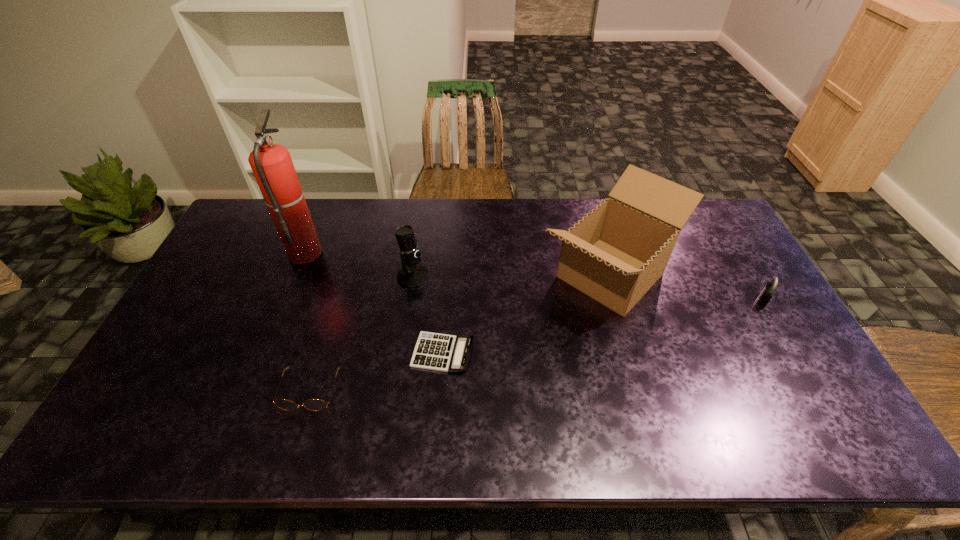
Find the location of a particular element. This screenshot has width=960, height=540. empty location between the shortest object and the leftmost object is located at coordinates (374, 302).

Identify the location of free spot between the fire extinguisher and the sunglasses. (307, 321).

You are a GUI agent. You are given a task and a screenshot of the screen. Output one action in this format:
    pyautogui.click(x=<x>, y=<y>)
    Task: Click on the vacant region between the padlock and the calculator
    Image resolution: width=960 pixels, height=540 pixels.
    Given the screenshot: What is the action you would take?
    pyautogui.click(x=603, y=327)

Identify the location of free point between the sunglasses and the second tallest object. The width and height of the screenshot is (960, 540). (460, 333).

I want to click on object identified as the fourth closest to the second tallest object, so click(311, 404).

This screenshot has height=540, width=960. I want to click on object that is the closest to the box, so click(x=766, y=294).

At what (x,y) coordinates should I click in order to perform the action: click on vacant point that satisfies the following two spatial constraints: 1. with the nozzle and gauge on the fire extinguisher; 2. on the right side of the padlock. Please return your answer as a coordinate pair (x, y). Image resolution: width=960 pixels, height=540 pixels. Looking at the image, I should click on (285, 300).

Find the location of a particular element. The height and width of the screenshot is (540, 960). vacant space that satisfies the following two spatial constraints: 1. with the nozzle and gauge on the fire extinguisher; 2. on the back side of the calculator is located at coordinates (264, 353).

Image resolution: width=960 pixels, height=540 pixels. I want to click on vacant point that satisfies the following two spatial constraints: 1. on the back side of the padlock; 2. on the left side of the shortest object, so click(446, 300).

This screenshot has width=960, height=540. What are the coordinates of `vacant point that satisfies the following two spatial constraints: 1. on the back side of the rightmost object; 2. with the nozzle and gauge on the leftmost object` in the screenshot? It's located at (733, 251).